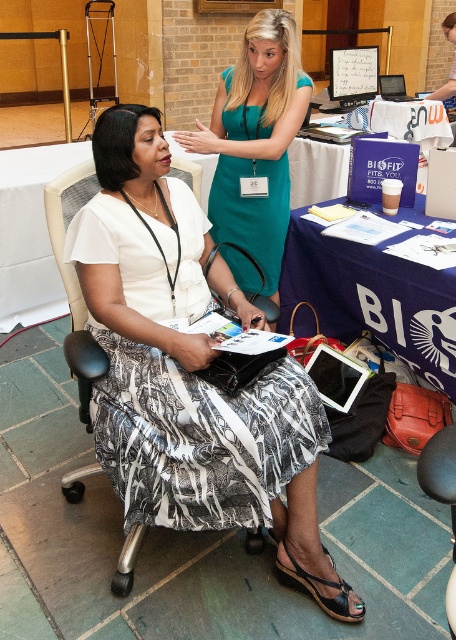
Is teal satin dress at upper center thinner than black fabric chair at left?

In fact, teal satin dress at upper center might be wider than black fabric chair at left.

Which is behind, point (263, 243) or point (122, 595)?

Positioned behind is point (263, 243).

In order to click on teal satin dress at upper center in this screenshot , I will do `click(252, 209)`.

Is white matte tablet at center below teal satin dress at upper center?

Correct, white matte tablet at center is located below teal satin dress at upper center.

Does white matte tablet at center lie in front of teal satin dress at upper center?

That is True.

Which is behind, point (374, 252) or point (283, 211)?

Positioned behind is point (283, 211).

The width and height of the screenshot is (456, 640). Identify the location of white matte tablet at center. pos(373,298).

Between point (419, 220) and point (88, 186), which one is positioned in front?

Point (88, 186) is in front.

The height and width of the screenshot is (640, 456). Identify the location of white matte tablet at center. (373, 298).

Identify the location of white matte tablet at center. This screenshot has width=456, height=640. coord(373,298).